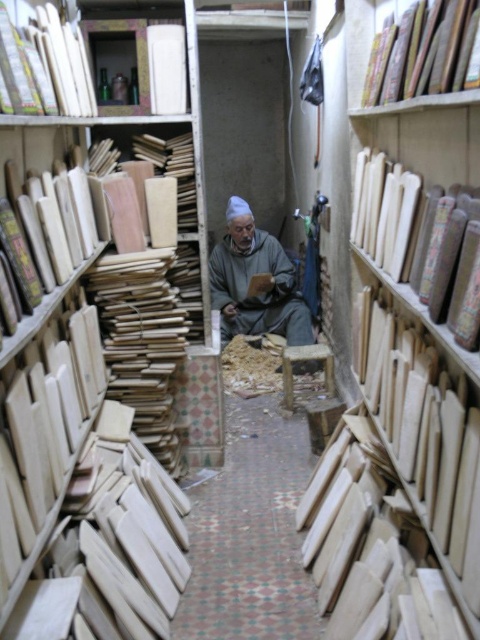
Can you confirm if light brown wood bookshelf at left is thinner than wooden stool at center?

Incorrect, light brown wood bookshelf at left's width is not less than wooden stool at center's.

Is light brown wood bookshelf at left positioned behind wooden stool at center?

No, it is in front of wooden stool at center.

Consider the image. Who is more forward, (36, 340) or (302, 349)?

Point (36, 340) is in front.

What are the coordinates of `light brown wood bookshelf at left` in the screenshot? It's located at (x=78, y=444).

Measure the distance between point (460,36) and camera.

A distance of 1.21 meters exists between point (460,36) and camera.

Does hardcover book at upper right have a lesser height compared to smooth wood plank at upper left?

Indeed, hardcover book at upper right has a lesser height compared to smooth wood plank at upper left.

Does point (379, 80) lie in front of point (39, 56)?

No, (379, 80) is further to viewer.

You are a GUI agent. You are given a task and a screenshot of the screen. Output one action in this format:
    pyautogui.click(x=<x>, y=<y>)
    Task: Click on the hardcover book at upper right
    The height and width of the screenshot is (640, 480).
    Given the screenshot: What is the action you would take?
    pyautogui.click(x=423, y=52)

Who is positioned more to the right, wooden boards at right or smooth wood plank at upper left?

wooden boards at right

Is wooden boards at right below smooth wood plank at upper left?

Yes.

Who is more forward, (476, 125) or (49, 65)?

Point (476, 125)

Where is `wooden boards at right`? The width and height of the screenshot is (480, 640). wooden boards at right is located at coordinates (387, 138).